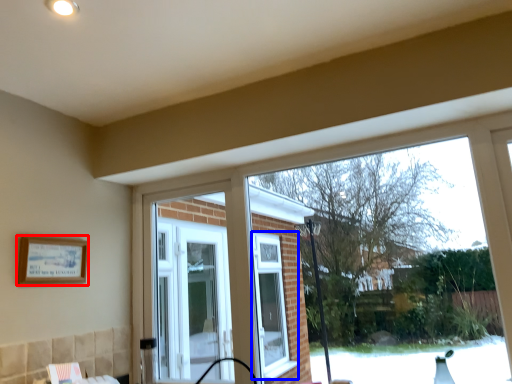
Question: Among these objects, which one is farthest to the camera, picture frame (highlighted by a red box) or window (highlighted by a blue box)?

Choices:
 (A) picture frame
 (B) window

Answer: (B)